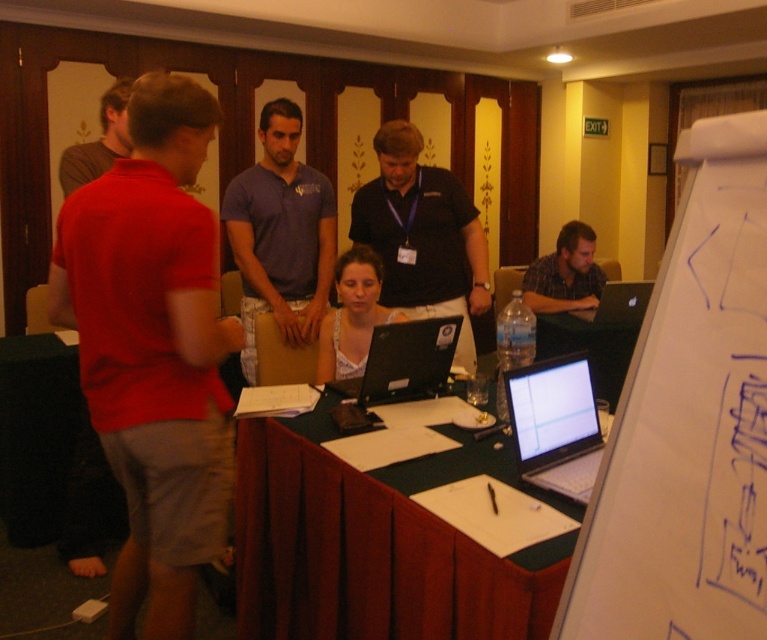
Image resolution: width=767 pixels, height=640 pixels. What do you see at coordinates (400, 362) in the screenshot? I see `black glossy laptop at center` at bounding box center [400, 362].

Is point (436, 378) behind point (627, 324)?

No, it is not.

The image size is (767, 640). Describe the element at coordinates (400, 362) in the screenshot. I see `black glossy laptop at center` at that location.

I want to click on black glossy laptop at center, so click(x=400, y=362).

Is matte blue shirt at center below plaid fabric shirt at center?

Incorrect, matte blue shirt at center is not positioned below plaid fabric shirt at center.

Is point (268, 129) positioned after point (542, 308)?

No, it is in front of (542, 308).

Image resolution: width=767 pixels, height=640 pixels. Identify the location of matte blue shirt at center. (280, 234).

Can you confirm if plaid fabric shirt at center is shorter than silver metallic laptop at right?

In fact, plaid fabric shirt at center may be taller than silver metallic laptop at right.

Is plaid fabric shirt at center below silver metallic laptop at right?

No.

Who is more forward, (598, 298) or (614, 300)?

Point (614, 300) is in front.

This screenshot has height=640, width=767. In order to click on plaid fabric shirt at center in this screenshot , I will do `click(565, 273)`.